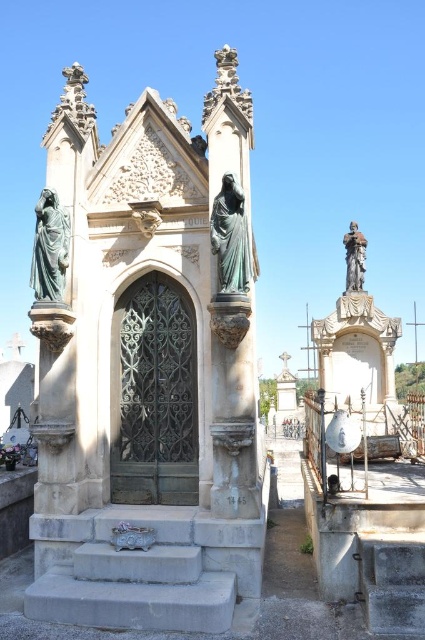
Is green patina statue at center bigger than bronze statue at upper right?

No.

Who is positioned more to the left, green patina statue at center or bronze statue at upper right?

From the viewer's perspective, green patina statue at center appears more on the left side.

Is point (217, 253) closer to camera compared to point (346, 234)?

That is True.

Where is `green patina statue at center`? green patina statue at center is located at coordinates (232, 240).

Who is positioned more to the right, gray concrete stair at lower right or green marble statue at left?

From the viewer's perspective, gray concrete stair at lower right appears more on the right side.

Is gray concrete stair at lower right smaller than green marble statue at left?

No, gray concrete stair at lower right is not smaller than green marble statue at left.

Locate an element on the screen. gray concrete stair at lower right is located at coordinates (393, 580).

Does green patina stone statue at center appear on the right side of gray concrete stair at lower right?

No, green patina stone statue at center is not to the right of gray concrete stair at lower right.

Image resolution: width=425 pixels, height=640 pixels. What do you see at coordinates (232, 296) in the screenshot?
I see `green patina stone statue at center` at bounding box center [232, 296].

The height and width of the screenshot is (640, 425). What do you see at coordinates (232, 296) in the screenshot?
I see `green patina stone statue at center` at bounding box center [232, 296].

I want to click on green patina stone statue at center, so click(232, 296).